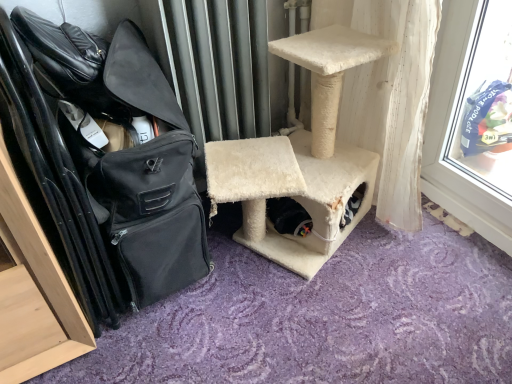
Question: Is black fabric shoulder bag at left to the right of beige carpeted cat tree at center from the viewer's perspective?

Choices:
 (A) no
 (B) yes

Answer: (A)

Question: Considering the relative sizes of black fabric shoulder bag at left and beige carpeted cat tree at center in the image provided, is black fabric shoulder bag at left shorter than beige carpeted cat tree at center?

Choices:
 (A) yes
 (B) no

Answer: (B)

Question: Is black fabric shoulder bag at left turned away from beige carpeted cat tree at center?

Choices:
 (A) no
 (B) yes

Answer: (A)

Question: Is black fabric shoulder bag at left directly adjacent to beige carpeted cat tree at center?

Choices:
 (A) yes
 (B) no

Answer: (B)

Question: Does black fabric shoulder bag at left have a lesser width compared to beige carpeted cat tree at center?

Choices:
 (A) yes
 (B) no

Answer: (A)

Question: Is the depth of black fabric shoulder bag at left greater than that of beige carpeted cat tree at center?

Choices:
 (A) no
 (B) yes

Answer: (A)

Question: From the image's perspective, is beige carpeted cat tree at center located above black fabric shoulder bag at left?

Choices:
 (A) yes
 (B) no

Answer: (A)

Question: Considering the relative sizes of beige carpeted cat tree at center and black fabric shoulder bag at left in the image provided, is beige carpeted cat tree at center smaller than black fabric shoulder bag at left?

Choices:
 (A) no
 (B) yes

Answer: (A)

Question: Is beige carpeted cat tree at center oriented away from black fabric shoulder bag at left?

Choices:
 (A) yes
 (B) no

Answer: (B)

Question: Could you tell me if beige carpeted cat tree at center is facing black fabric shoulder bag at left?

Choices:
 (A) yes
 (B) no

Answer: (B)

Question: Is beige carpeted cat tree at center completely or partially outside of black fabric shoulder bag at left?

Choices:
 (A) yes
 (B) no

Answer: (A)

Question: Does beige carpeted cat tree at center come in front of black fabric shoulder bag at left?

Choices:
 (A) yes
 (B) no

Answer: (B)

Question: Looking at their shapes, would you say black fabric shoulder bag at left is wider or thinner than beige carpeted cat tree at center?

Choices:
 (A) thin
 (B) wide

Answer: (A)